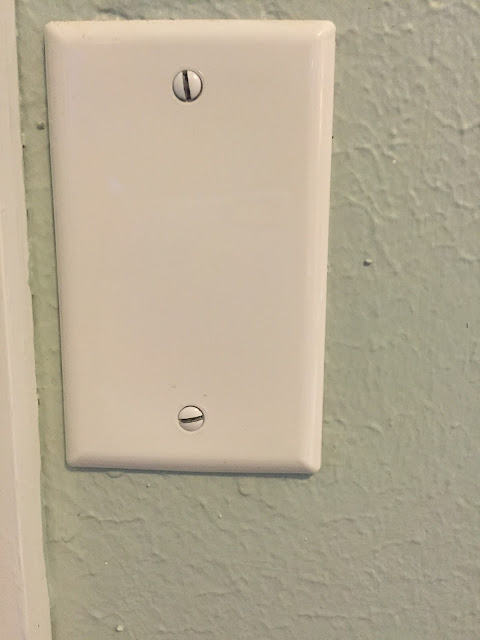
Locate an element on the screen. plastic cover is located at coordinates (187, 188).